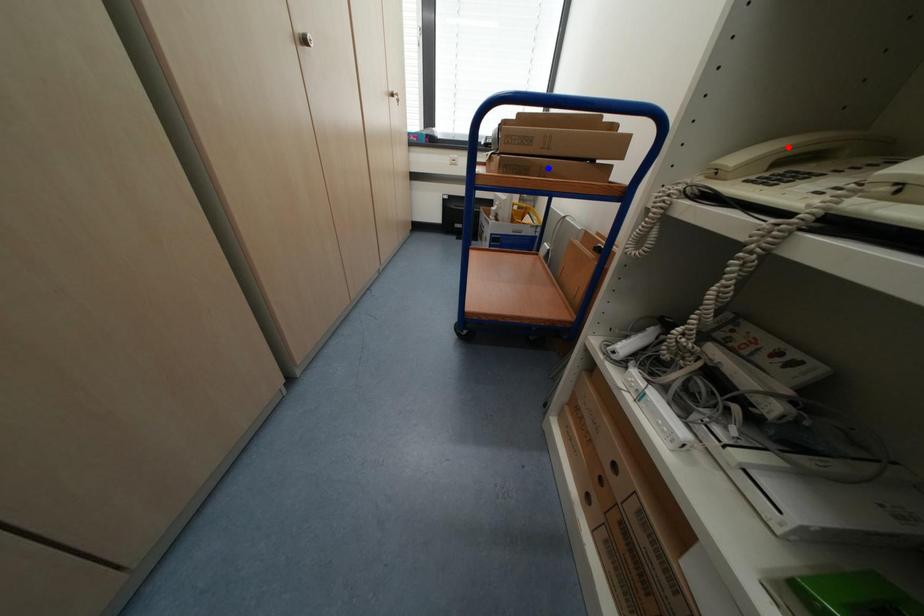
Question: In the image, two points are highlighted. Which point is nearer to the camera? Reply with the corresponding letter.

Choices:
 (A) blue point
 (B) red point

Answer: (B)